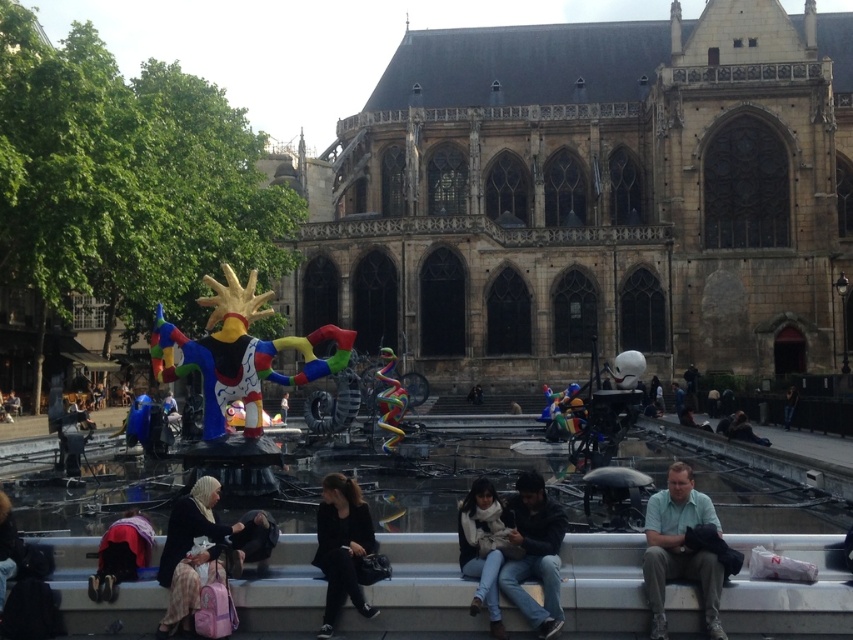
From the picture: Does dark blue jeans at center appear on the right side of plaid skirt at lower left?

Indeed, dark blue jeans at center is positioned on the right side of plaid skirt at lower left.

Between dark blue jeans at center and plaid skirt at lower left, which one has more height?

With more height is dark blue jeans at center.

The image size is (853, 640). What do you see at coordinates (535, 554) in the screenshot?
I see `dark blue jeans at center` at bounding box center [535, 554].

Locate an element on the screen. This screenshot has width=853, height=640. dark blue jeans at center is located at coordinates (535, 554).

Which is behind, point (548, 522) or point (143, 547)?

The point (143, 547) is behind.

Between dark blue jeans at center and dark blue fabric at lower left, which one is positioned higher?

dark blue jeans at center is higher up.

Locate an element on the screen. This screenshot has height=640, width=853. dark blue jeans at center is located at coordinates (535, 554).

Identify the location of dark blue jeans at center. The width and height of the screenshot is (853, 640). (535, 554).

Can you confirm if light green shirt at lower right is positioned to the right of white scarf at lower center?

Yes, light green shirt at lower right is to the right of white scarf at lower center.

Is light green shirt at lower right wider than white scarf at lower center?

Correct, the width of light green shirt at lower right exceeds that of white scarf at lower center.

The image size is (853, 640). In order to click on light green shirt at lower right in this screenshot , I will do `click(679, 548)`.

I want to click on light green shirt at lower right, so click(679, 548).